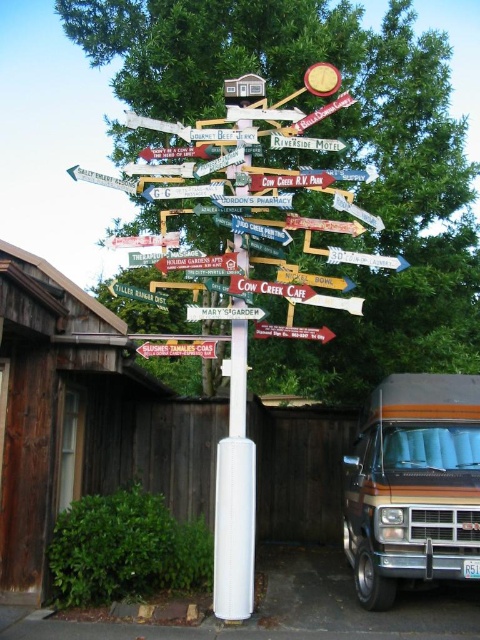
Question: Which is farther from the green painted wooden signpost at upper center?

Choices:
 (A) white plastic pole at center
 (B) wooden signpost at center
 (C) green painted wooden signpost at center

Answer: (B)

Question: Where is white plastic pole at center located in relation to green painted wooden signpost at center in the image?

Choices:
 (A) right
 (B) left

Answer: (A)

Question: Based on their relative distances, which object is nearer to the white plastic pole at center?

Choices:
 (A) green painted wooden signpost at center
 (B) wooden signpost at upper center
 (C) green painted wooden signpost at upper center

Answer: (B)

Question: Which object is positioned farthest from the wooden signpost at center?

Choices:
 (A) wooden signpost at upper center
 (B) white plastic pole at center
 (C) green painted wooden signpost at upper center
 (D) green painted wooden signpost at center

Answer: (C)

Question: Is green painted wooden signpost at upper center closer to camera compared to green painted wooden signpost at center?

Choices:
 (A) no
 (B) yes

Answer: (A)

Question: Is white plastic pole at center thinner than green painted wooden signpost at center?

Choices:
 (A) no
 (B) yes

Answer: (B)